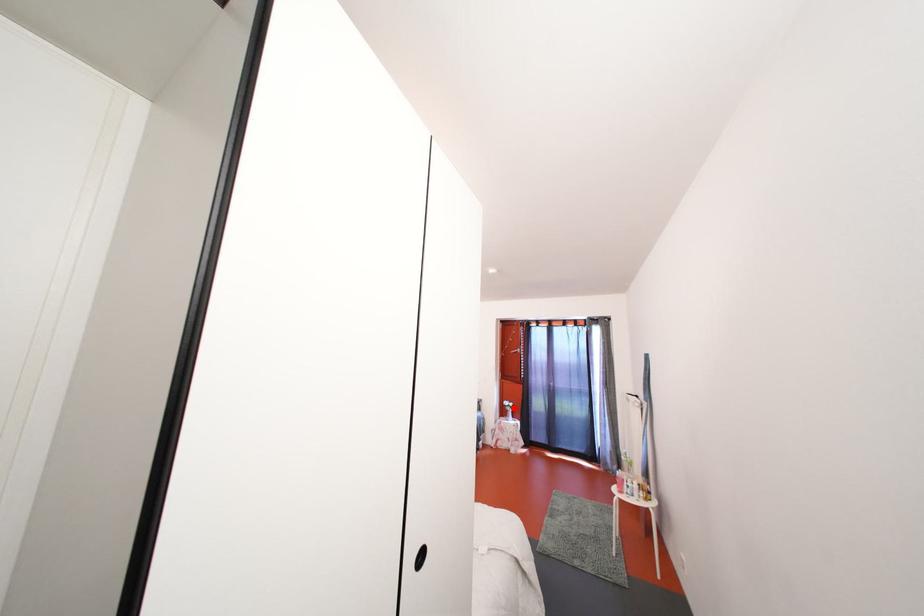
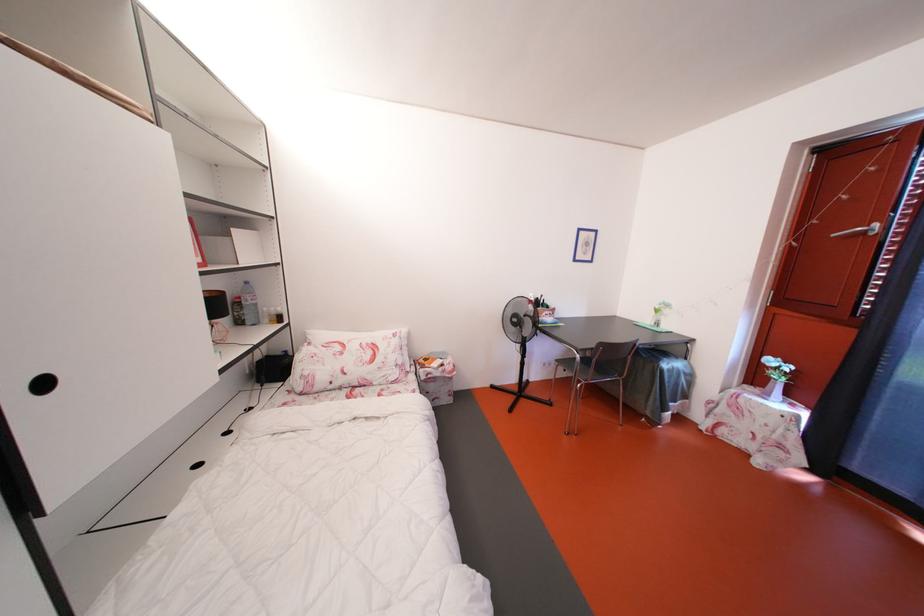
Question: I am providing you with two images of the same scene from different viewpoints. Image1 has a red point marked. In image2, the corresponding 3D location appears at what relative position? Reply with the corresponding letter.

Choices:
 (A) Closer
 (B) Farther

Answer: (A)